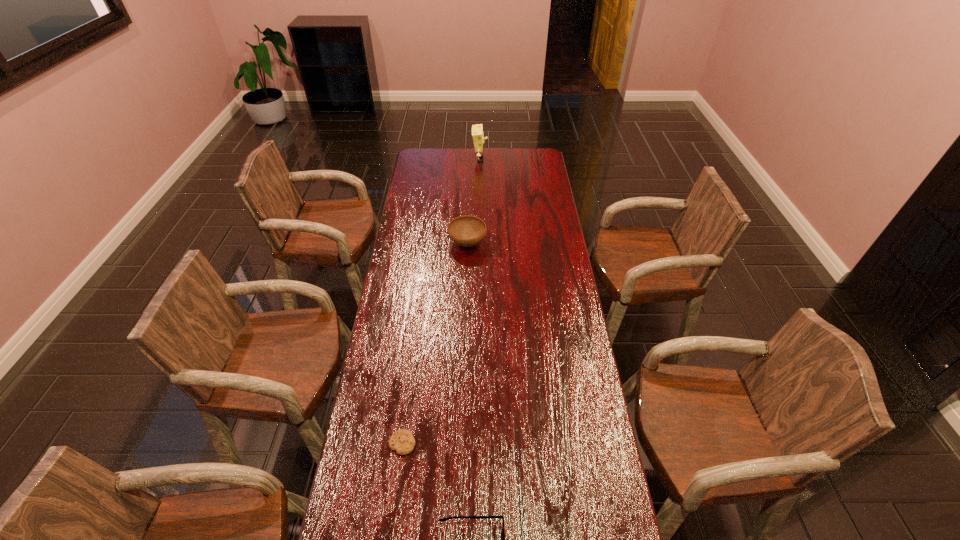
You are a GUI agent. You are given a task and a screenshot of the screen. Output one action in this format:
    pyautogui.click(x=<x>, y=<y>)
    Task: Click on the blank region between the bowl and the second nearest object
    The height and width of the screenshot is (540, 960).
    Given the screenshot: What is the action you would take?
    pyautogui.click(x=435, y=343)

Locate an element on the screen. The image size is (960, 540). vacant area between the third farthest object and the second tallest object is located at coordinates (435, 343).

Select which object is the second closest to the spectacles. Please provide its 2D coordinates. Your answer should be formatted as a tuple, i.e. [(x, y)], where the tuple contains the x and y coordinates of a point satisfying the conditions above.

[(466, 230)]

Point out which object is positioned as the third nearest to the third farthest object. Please provide its 2D coordinates. Your answer should be formatted as a tuple, i.e. [(x, y)], where the tuple contains the x and y coordinates of a point satisfying the conditions above.

[(477, 130)]

Identify the location of free location that satisfies the following two spatial constraints: 1. on the face of the tallest object; 2. on the front side of the cookie. The height and width of the screenshot is (540, 960). (479, 443).

This screenshot has height=540, width=960. Identify the location of free space that satisfies the following two spatial constraints: 1. on the back side of the third shortest object; 2. on the right side of the leftmost object. (428, 243).